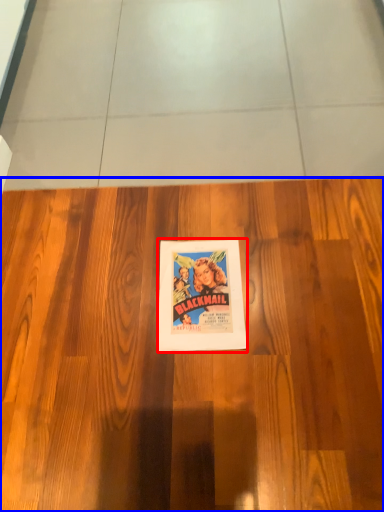
Question: Which point is closer to the camera, poster (highlighted by a red box) or hardwood (highlighted by a blue box)?

Choices:
 (A) poster
 (B) hardwood

Answer: (B)